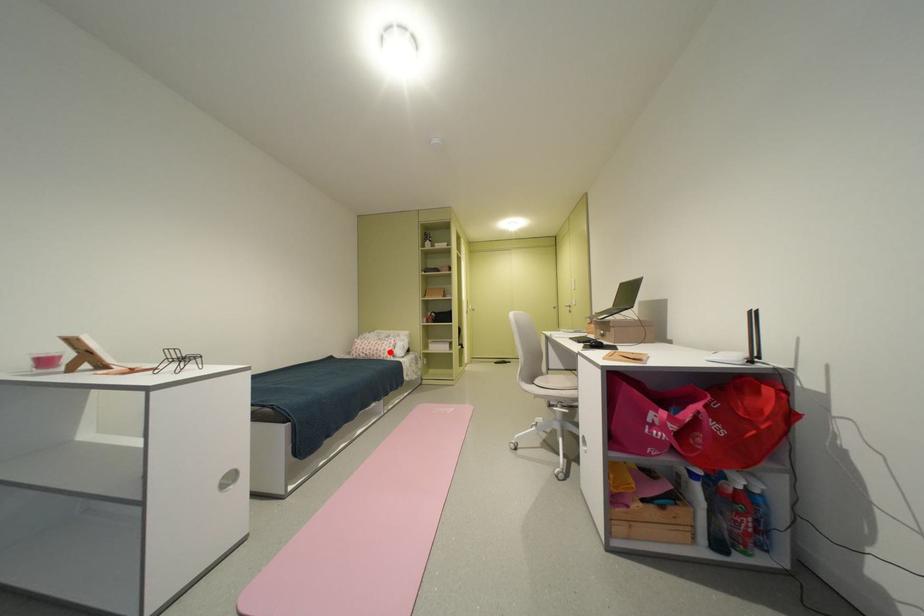
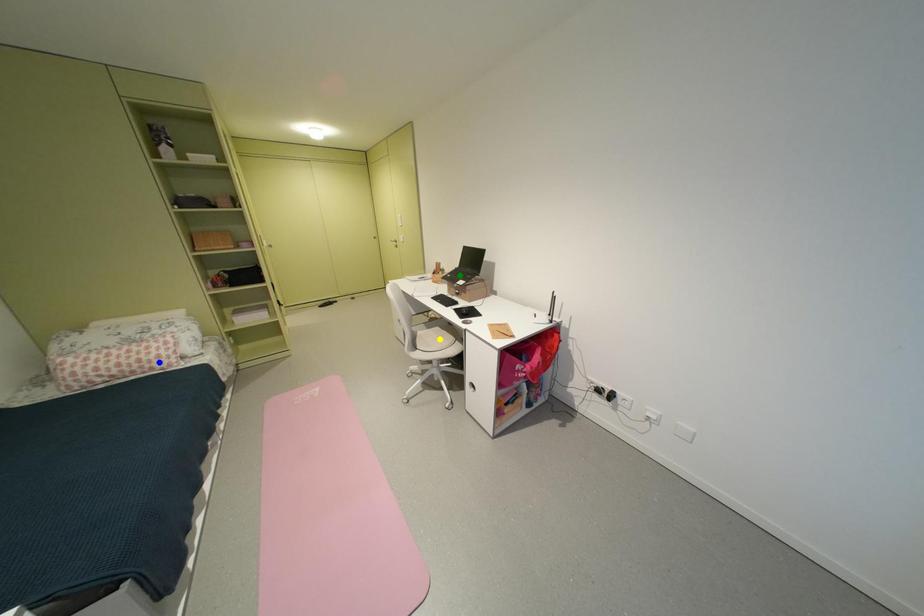
Question: I am providing you with two images of the same scene from different viewpoints. A red point is marked on the first image. You are given multiple points on the second image. Which point in image 2 is actually the same real-world point as the red point in image 1?

Choices:
 (A) green point
 (B) yellow point
 (C) blue point

Answer: (C)